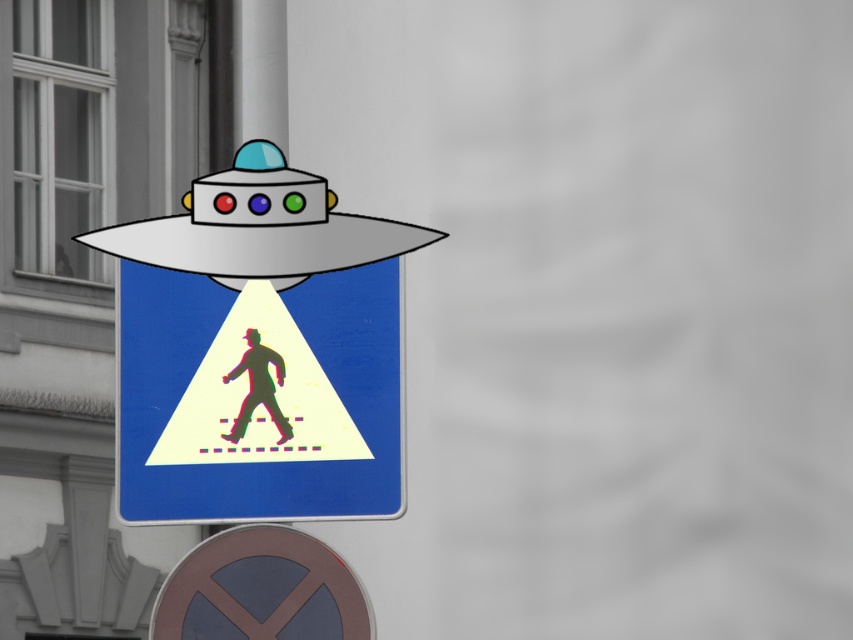
Question: Which object is farther from the camera taking this photo?

Choices:
 (A) metallic pedestrian crossing sign at center
 (B) silhouette pedestrian at center
 (C) metallic gray circle at lower center

Answer: (B)

Question: Is metallic pedestrian crossing sign at center bigger than silhouette pedestrian at center?

Choices:
 (A) no
 (B) yes

Answer: (B)

Question: Where is metallic pedestrian crossing sign at center located in relation to silhouette pedestrian at center in the image?

Choices:
 (A) below
 (B) above

Answer: (A)

Question: Which point is farther to the camera?

Choices:
 (A) (293, 538)
 (B) (329, 490)

Answer: (B)

Question: Does metallic pedestrian crossing sign at center have a smaller size compared to silhouette pedestrian at center?

Choices:
 (A) yes
 (B) no

Answer: (B)

Question: Which point is farther to the camera?

Choices:
 (A) (222, 378)
 (B) (305, 422)

Answer: (A)